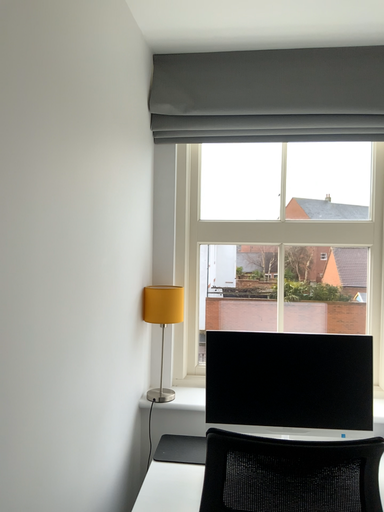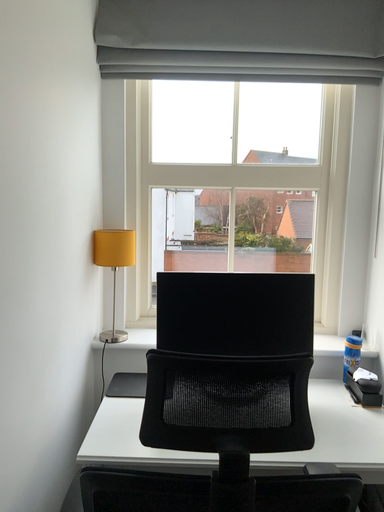
Question: How did the camera likely rotate when shooting the video?

Choices:
 (A) rotated upward
 (B) rotated downward

Answer: (B)